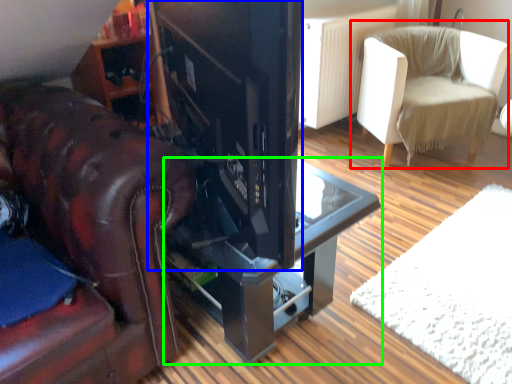
Question: Which is farther away from chair (highlighted by a red box)? appliance (highlighted by a blue box) or table (highlighted by a green box)?

Choices:
 (A) appliance
 (B) table

Answer: (A)